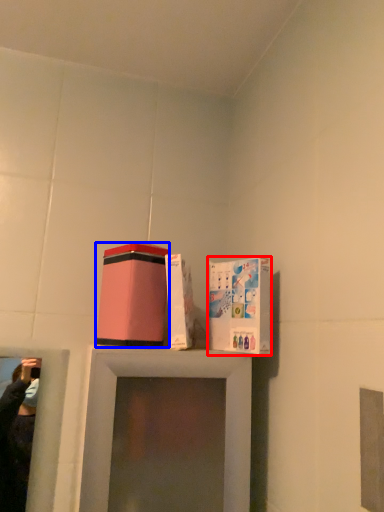
Question: Which of the following is the farthest to the observer, cardboard box (highlighted by a red box) or box (highlighted by a blue box)?

Choices:
 (A) cardboard box
 (B) box

Answer: (B)